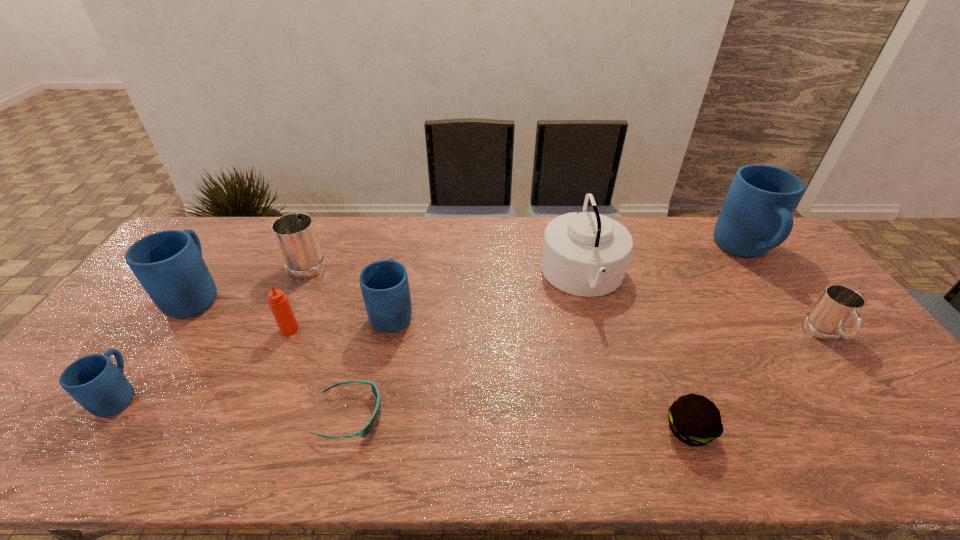
Where is `blank space at the right edge of the desktop`? The image size is (960, 540). blank space at the right edge of the desktop is located at coordinates tap(841, 390).

In the image, there is a desktop. Identify the location of vacant region at the near left corner. This screenshot has height=540, width=960. (30, 465).

You are a GUI agent. You are given a task and a screenshot of the screen. Output one action in this format:
    pyautogui.click(x=<x>, y=<y>)
    Task: Click on the vacant area that lies between the Tabasco sauce and the third smallest blue mug
    Image resolution: width=960 pixels, height=540 pixels.
    Given the screenshot: What is the action you would take?
    pyautogui.click(x=244, y=312)

Locate an element on the screen. vacant region between the smaller gray mug and the nearest mug is located at coordinates (472, 365).

Identify the location of free space between the Tabasco sauce and the rightmost blue mug. (517, 290).

Where is `free spot between the Tabasco sauce and the kettle`? free spot between the Tabasco sauce and the kettle is located at coordinates (437, 302).

Locate an element on the screen. The width and height of the screenshot is (960, 540). empty space that is in between the nearest mug and the bigger gray mug is located at coordinates (214, 328).

Locate an element on the screen. free spot between the nearest blue mug and the second biggest blue mug is located at coordinates (158, 345).

Image resolution: width=960 pixels, height=540 pixels. Find the location of `blank region between the fourth mug from left to right and the Tabasco sauce`. blank region between the fourth mug from left to right and the Tabasco sauce is located at coordinates (341, 321).

Where is `vacant point located between the shortest object and the Tabasco sauce`? vacant point located between the shortest object and the Tabasco sauce is located at coordinates (320, 372).